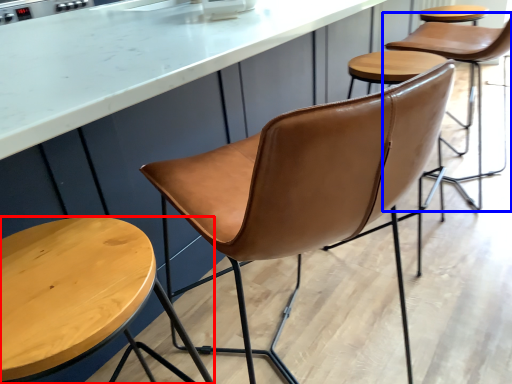
Question: Which object is further to the camera taking this photo, stool (highlighted by a red box) or chair (highlighted by a blue box)?

Choices:
 (A) stool
 (B) chair

Answer: (B)